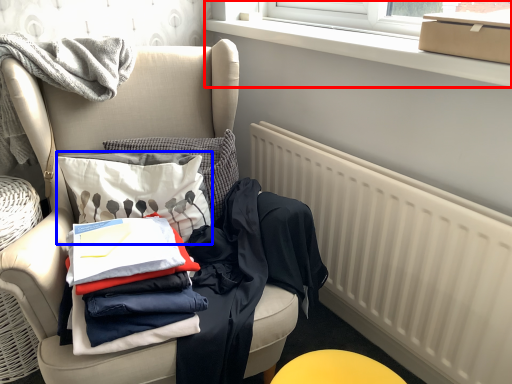
Question: Which object appears farthest to the camera in this image, window frame (highlighted by a red box) or throw pillow (highlighted by a blue box)?

Choices:
 (A) window frame
 (B) throw pillow

Answer: (B)